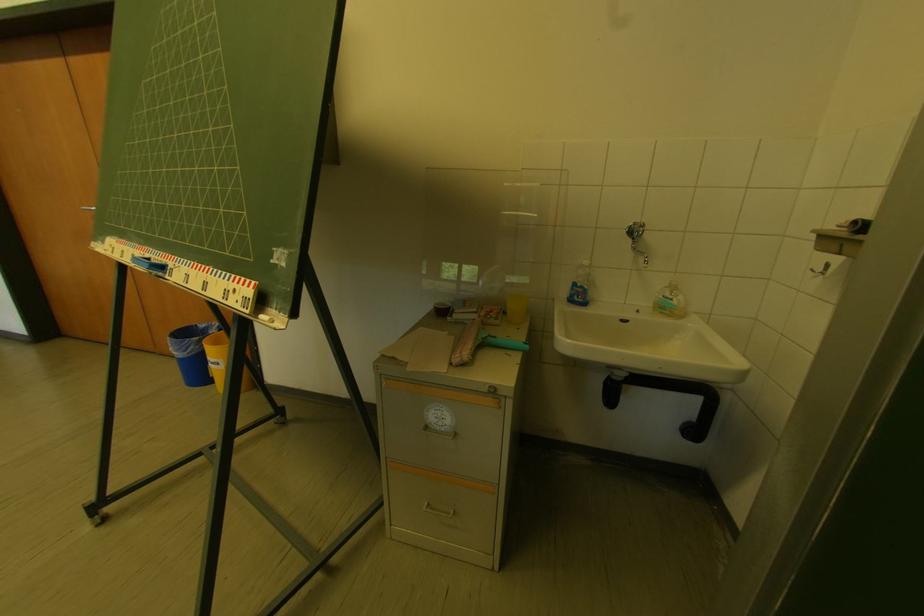
Find where to pull the bottom drawer handle. Please return your answer as a coordinate pair (x, y).

(442, 506)